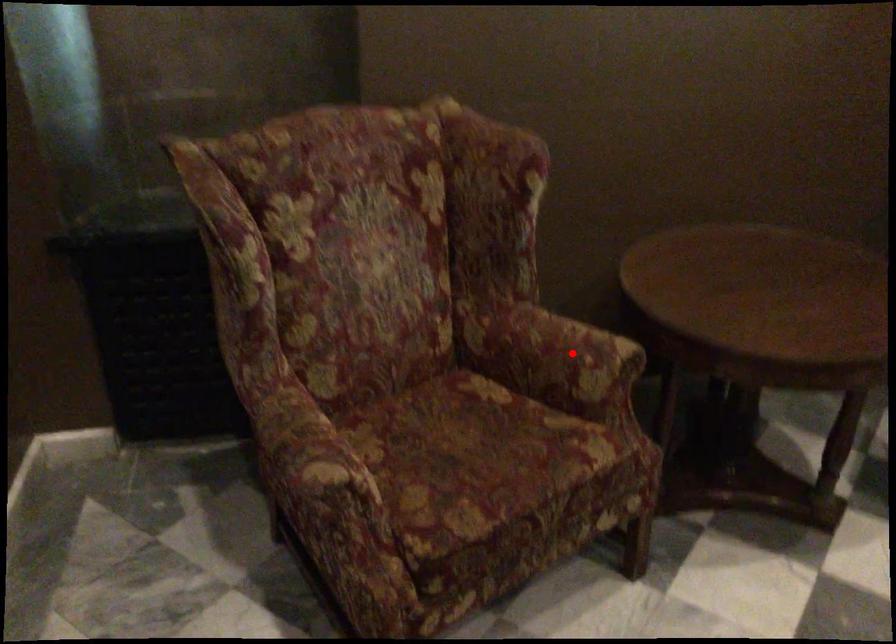
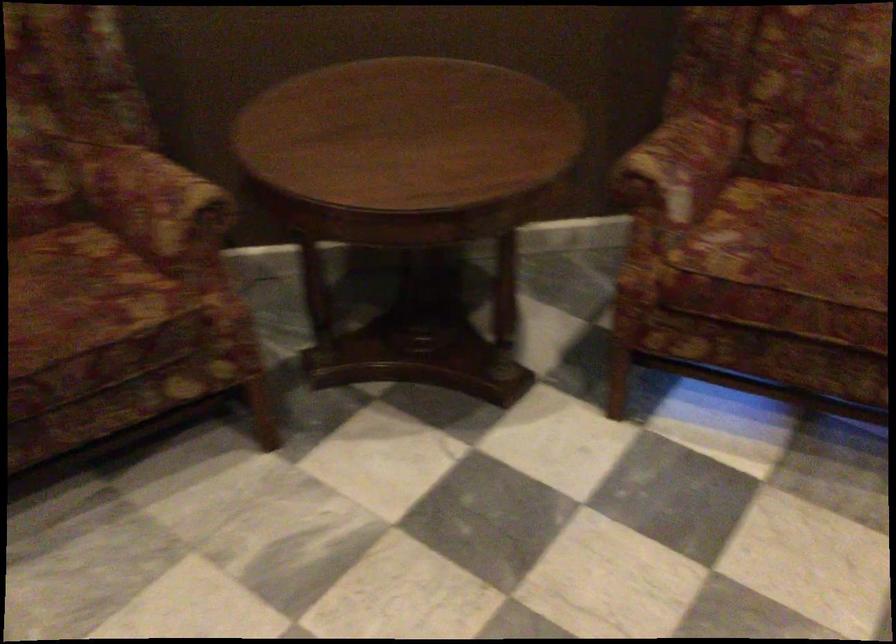
Question: I am providing you with two images of the same scene from different viewpoints. A red point is marked on the first image. Is the red point's position out of view in image 2?

Choices:
 (A) Yes
 (B) No

Answer: (B)